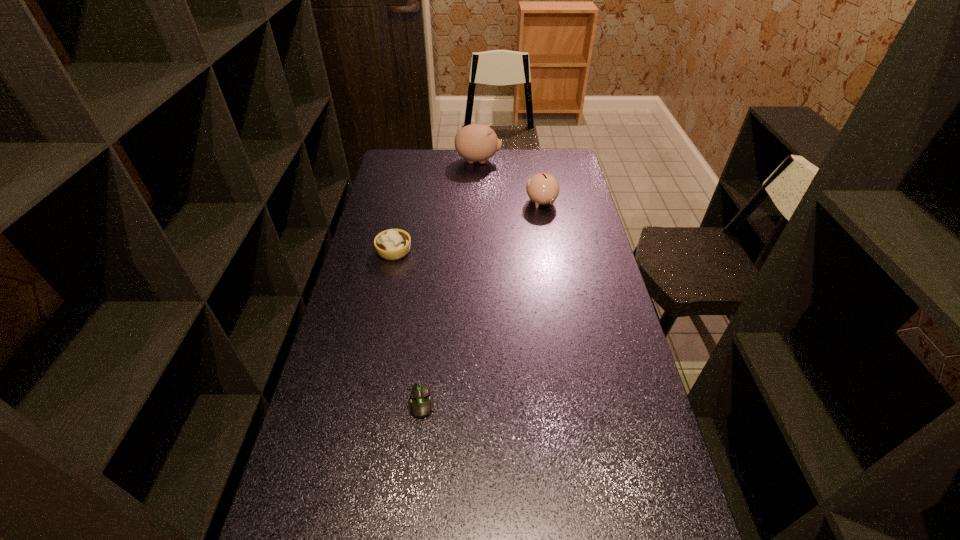
The image size is (960, 540). I want to click on the tallest object, so click(x=476, y=142).

Image resolution: width=960 pixels, height=540 pixels. What are the coordinates of `the farthest object` in the screenshot? It's located at (476, 142).

Locate an element on the screen. Image resolution: width=960 pixels, height=540 pixels. the shorter piggy bank is located at coordinates (542, 188).

Find the location of a particular element. This screenshot has width=960, height=540. the right piggy bank is located at coordinates (542, 188).

Locate an element on the screen. the second shortest object is located at coordinates (392, 244).

This screenshot has height=540, width=960. What are the coordinates of `whipped cream` in the screenshot? It's located at (392, 244).

This screenshot has width=960, height=540. In order to click on computer mouse in this screenshot , I will do `click(420, 405)`.

Find the location of a particular element. Image resolution: width=960 pixels, height=540 pixels. the shortest object is located at coordinates (420, 405).

Identify the location of blank space located 0.300m at the snout of the left piggy bank. (564, 161).

Identify the location of vacant space located 0.230m on the back of the second tallest object. (535, 165).